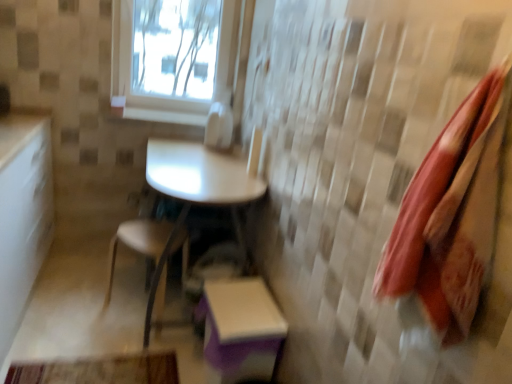
Find the location of a particular element. The image size is (512, 384). empty space that is ontop of metallic silver chair at center (from a real-world perspective) is located at coordinates (149, 235).